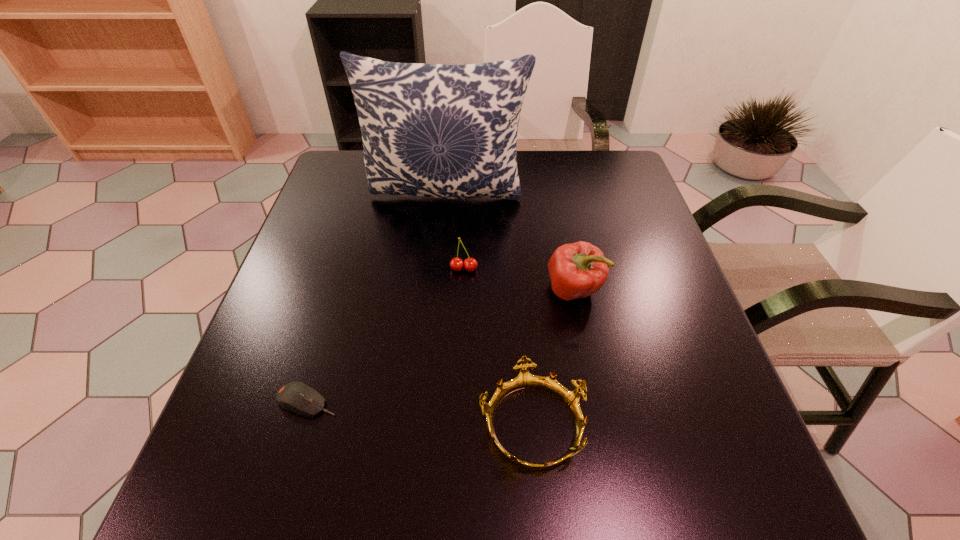
I want to click on vacant space located on the right of the shortest object, so click(479, 401).

This screenshot has width=960, height=540. I want to click on object that is at the far edge, so click(432, 130).

I want to click on object at the near edge, so click(x=524, y=380).

Locate an element on the screen. The image size is (960, 540). cushion that is at the left edge is located at coordinates (432, 130).

This screenshot has height=540, width=960. I want to click on computer mouse that is at the left edge, so click(297, 397).

Image resolution: width=960 pixels, height=540 pixels. I want to click on object present at the far left corner, so click(x=432, y=130).

This screenshot has width=960, height=540. Find the location of `free space at the near edge of the desktop`. free space at the near edge of the desktop is located at coordinates (632, 466).

Locate an element on the screen. The image size is (960, 540). free space at the left edge of the desktop is located at coordinates (357, 271).

You are a GUI agent. You are given a task and a screenshot of the screen. Output one action in this format:
    pyautogui.click(x=<x>, y=<y>)
    Task: Click on the free region at the right edge
    
    Given the screenshot: What is the action you would take?
    pyautogui.click(x=654, y=292)

Locate an element on the screen. The height and width of the screenshot is (540, 960). free location at the far left corner of the desktop is located at coordinates (357, 158).